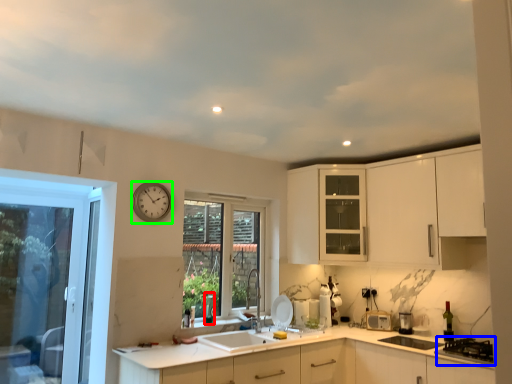
Question: Which is nearer to the wine bottle (highlighted by a red box)? gas stove (highlighted by a blue box) or clock (highlighted by a green box).

Choices:
 (A) gas stove
 (B) clock

Answer: (B)